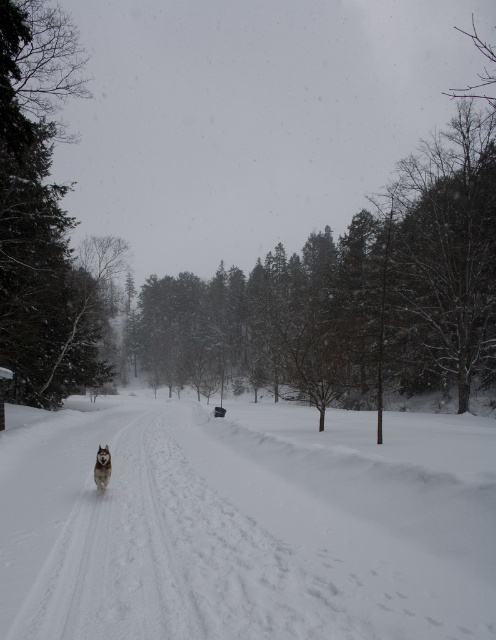
Between point (100, 432) and point (109, 461), which one is positioned in front?

Point (109, 461) is more forward.

Can you confirm if white fluffy snow at center is taller than white fluffy dog at center?

Yes.

Locate an element on the screen. The height and width of the screenshot is (640, 496). white fluffy snow at center is located at coordinates (246, 524).